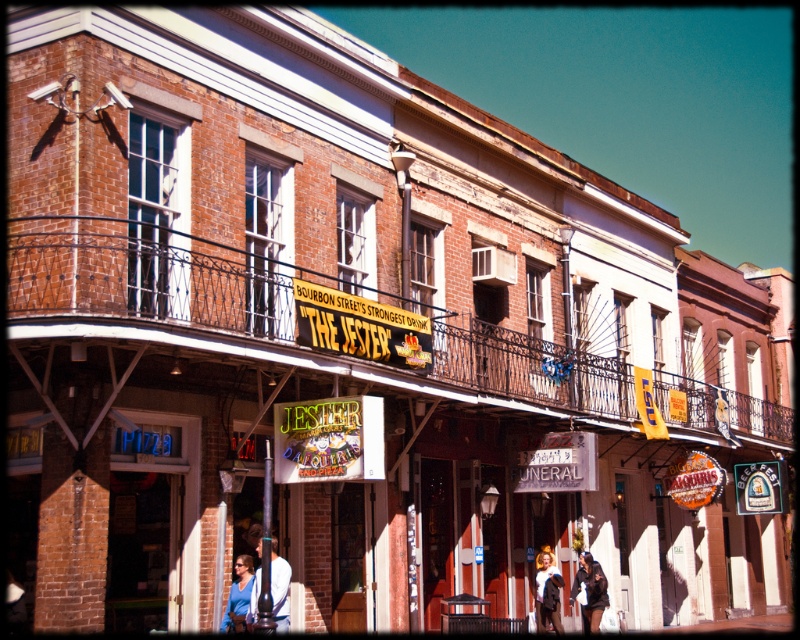
You are standing on the street looking at the building with the ornate balcony. There are two points marked on the image. Which point, point (224, 266) or point (604, 586), is closer to you?

Point (224, 266) is closer to you than point (604, 586).

You are a fashion designer observing a street scene and notice two shirts displayed in a shop window. The shirts are the white cotton shirt at center and the blue fabric shirt at lower center. Which shirt is smaller in size?

The white cotton shirt at center is smaller in size compared to the blue fabric shirt at lower center according to the description.